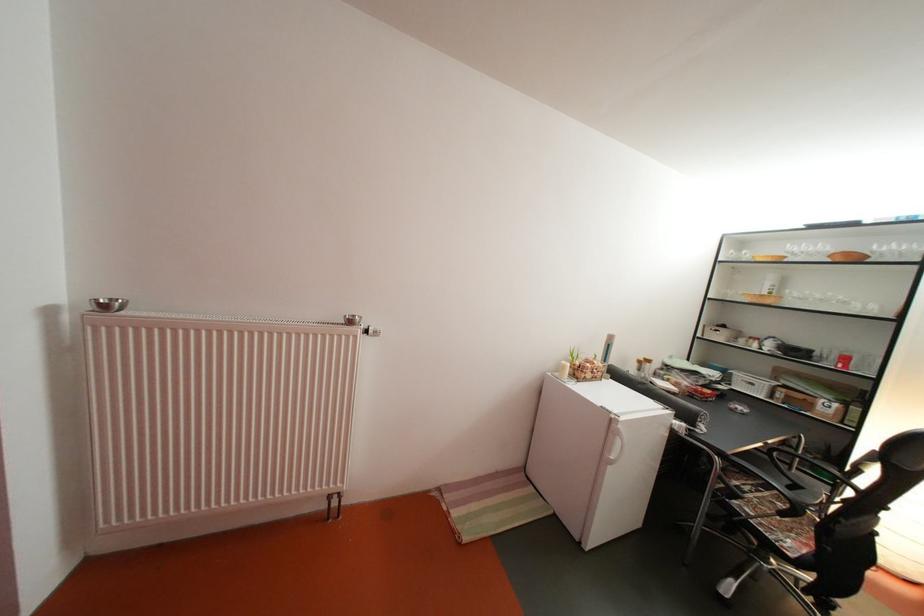
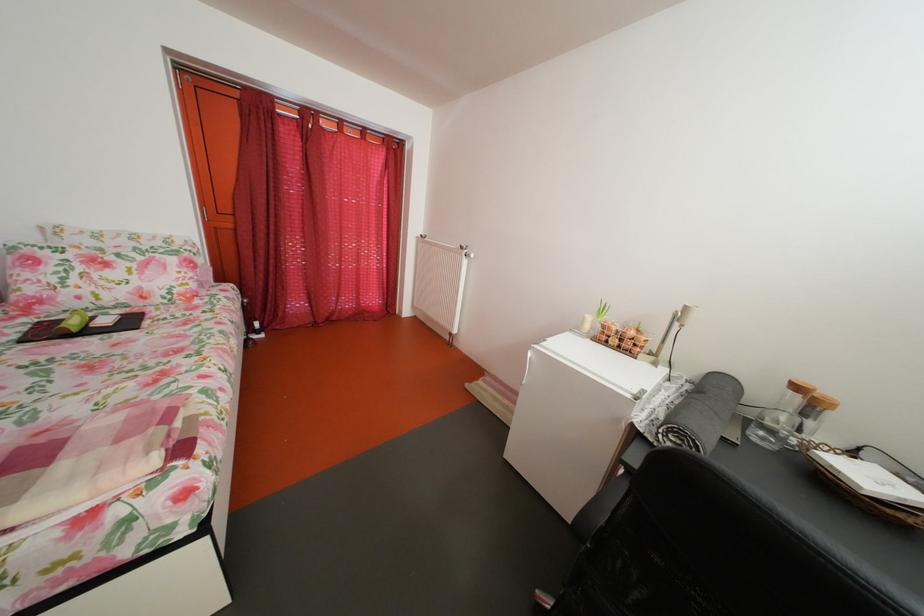
Find the pixel in the second image that matches (361,329) in the first image.

(473, 254)